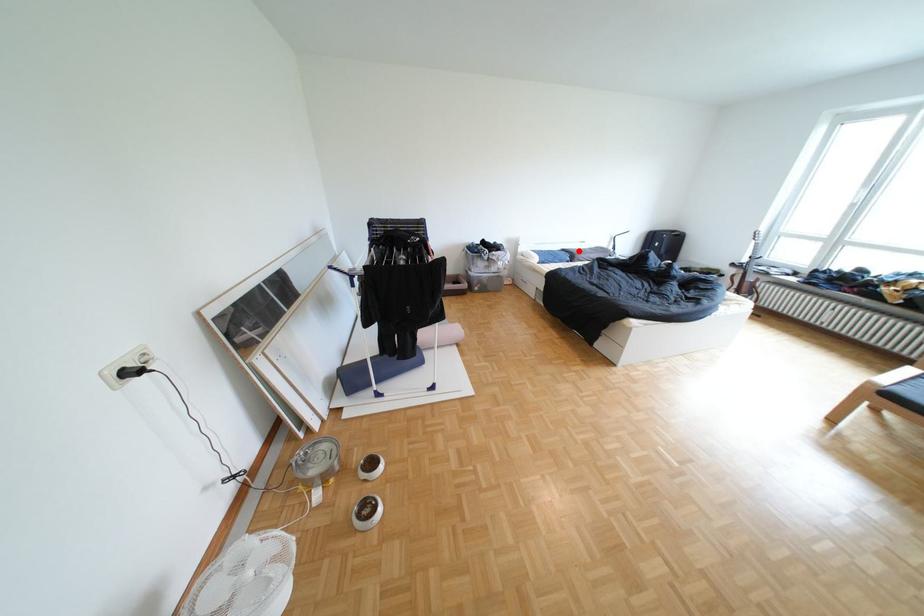
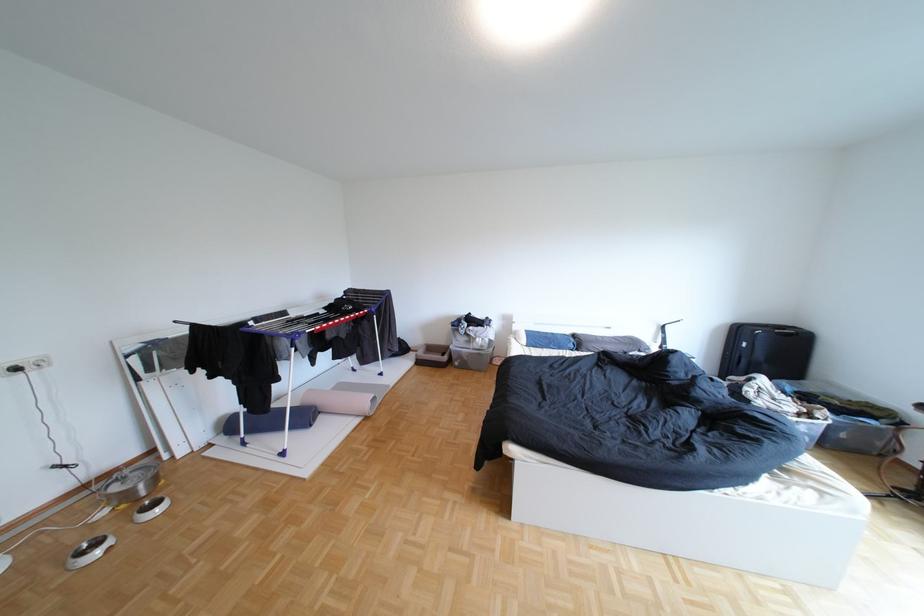
Question: I am providing you with two images of the same scene from different viewpoints. Image1 has a red point marked. In image2, the corresponding 3D location appears at what relative position? Reply with the corresponding letter.

Choices:
 (A) Closer
 (B) Farther

Answer: (B)